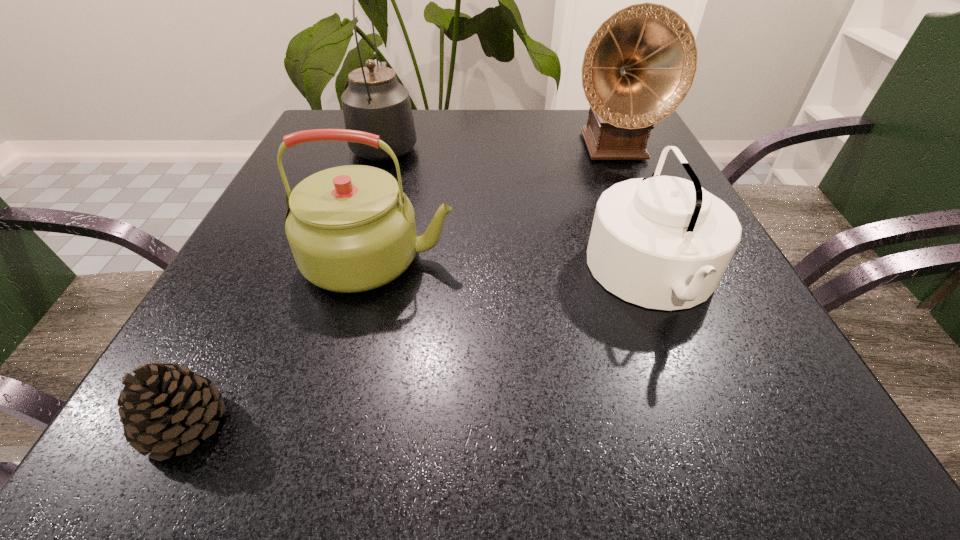
The width and height of the screenshot is (960, 540). What are the coordinates of `vacant region located 0.270m on the spout of the second shortest object` in the screenshot? It's located at pyautogui.click(x=425, y=275).

The width and height of the screenshot is (960, 540). What are the coordinates of `free space located 0.170m on the spout of the second shortest object` in the screenshot? It's located at (486, 275).

This screenshot has height=540, width=960. In order to click on blank space located 0.290m on the spout of the second shortest object in this screenshot , I will do `click(413, 275)`.

The image size is (960, 540). I want to click on kettle at the far edge, so click(x=375, y=102).

Where is `phonograph record situated at the far edge`? Image resolution: width=960 pixels, height=540 pixels. phonograph record situated at the far edge is located at coordinates (640, 64).

This screenshot has height=540, width=960. I want to click on object that is positioned at the near edge, so click(x=164, y=406).

Locate an element on the screen. pinecone at the left edge is located at coordinates (164, 406).

Image resolution: width=960 pixels, height=540 pixels. Identify the location of phonograph record located in the right edge section of the desktop. (640, 64).

Locate an element on the screen. The image size is (960, 540). kettle located in the right edge section of the desktop is located at coordinates (663, 242).

Where is `object positioned at the far left corner`? object positioned at the far left corner is located at coordinates (375, 102).